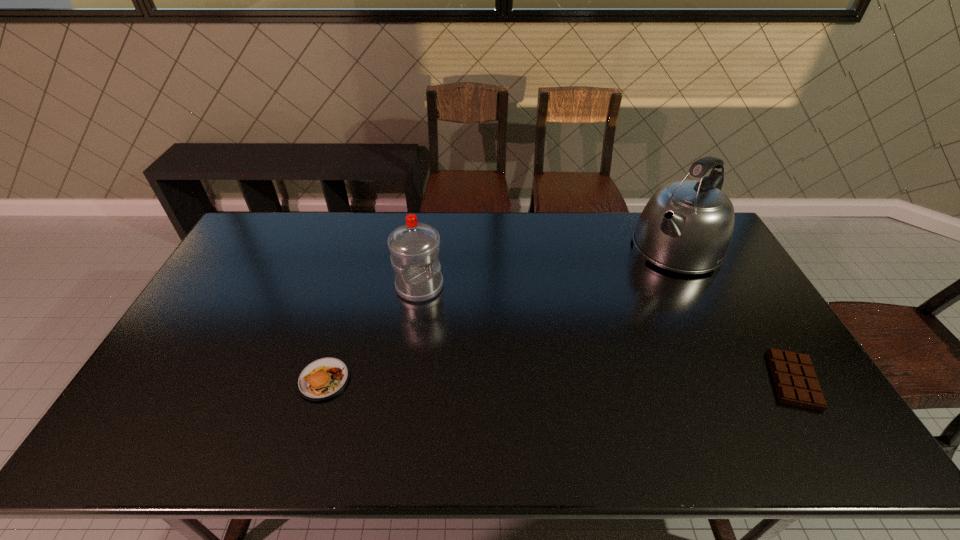
The image size is (960, 540). In order to click on free space on the desktop that is between the patty and the shortest object and is positioned on the spout of the tallest object in this screenshot , I will do `click(542, 380)`.

Identify the location of free space on the desktop that is between the patty and the candy bar and is positioned on the handle side of the second object from left to right. The width and height of the screenshot is (960, 540). (537, 380).